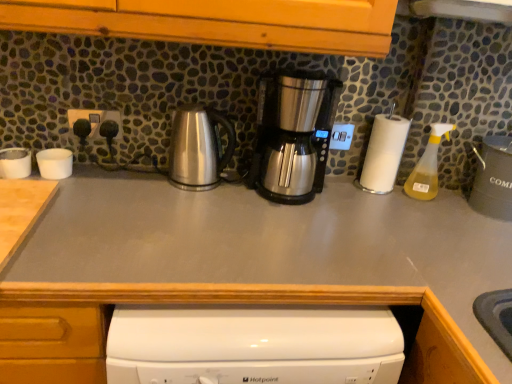
This screenshot has height=384, width=512. Identify the location of vacant region to the left of stainless steel coffee maker at center, marked as the 2th kitchen appliance in a left-to-right arrangement. (201, 195).